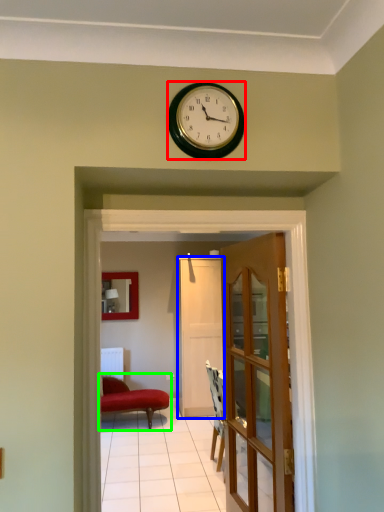
Question: Based on their relative distances, which object is nearer to wall clock (highlighted by a red box)? Choose from door (highlighted by a blue box) and studio couch (highlighted by a green box).

Choices:
 (A) door
 (B) studio couch

Answer: (B)